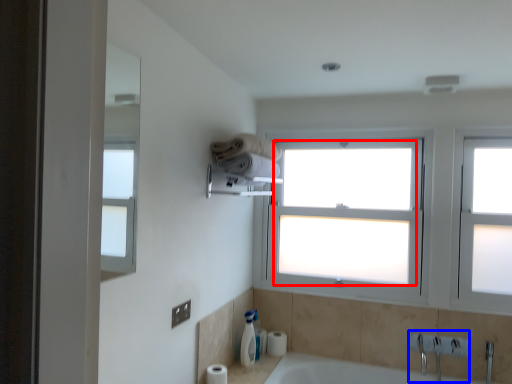
Question: Which object is closer to the camera taking this photo, window screen (highlighted by a red box) or sink (highlighted by a blue box)?

Choices:
 (A) window screen
 (B) sink

Answer: (B)